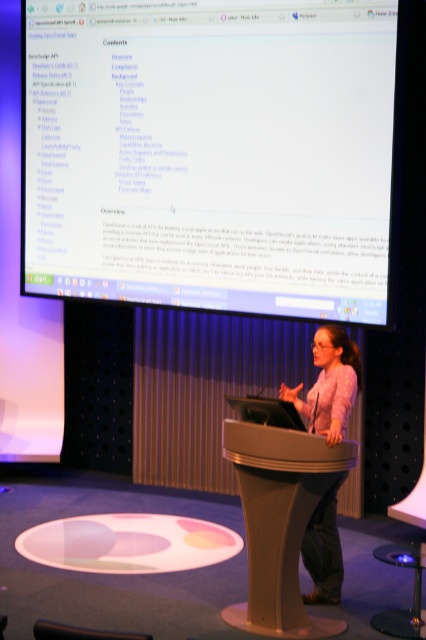
Does pink fabric at center appear under metallic stool at lower right?

No, pink fabric at center is not below metallic stool at lower right.

Which is in front, point (340, 368) or point (386, 561)?

Point (386, 561)

At what (x,y) coordinates should I click in order to perform the action: click on pink fabric at center. Please return your answer as a coordinate pair (x, y). This screenshot has height=640, width=426. Looking at the image, I should click on (330, 384).

Find the location of a particular element. The height and width of the screenshot is (640, 426). matte gray podium at center is located at coordinates (279, 520).

The width and height of the screenshot is (426, 640). Find the location of `matte gray podium at center`. matte gray podium at center is located at coordinates (279, 520).

Can you confirm if white glossy projection screen at upper center is thinner than matte gray podium at center?

Incorrect, white glossy projection screen at upper center's width is not less than matte gray podium at center's.

Does white glossy projection screen at upper center have a lesser height compared to matte gray podium at center?

No.

Locate an element on the screen. The image size is (426, 640). white glossy projection screen at upper center is located at coordinates (210, 154).